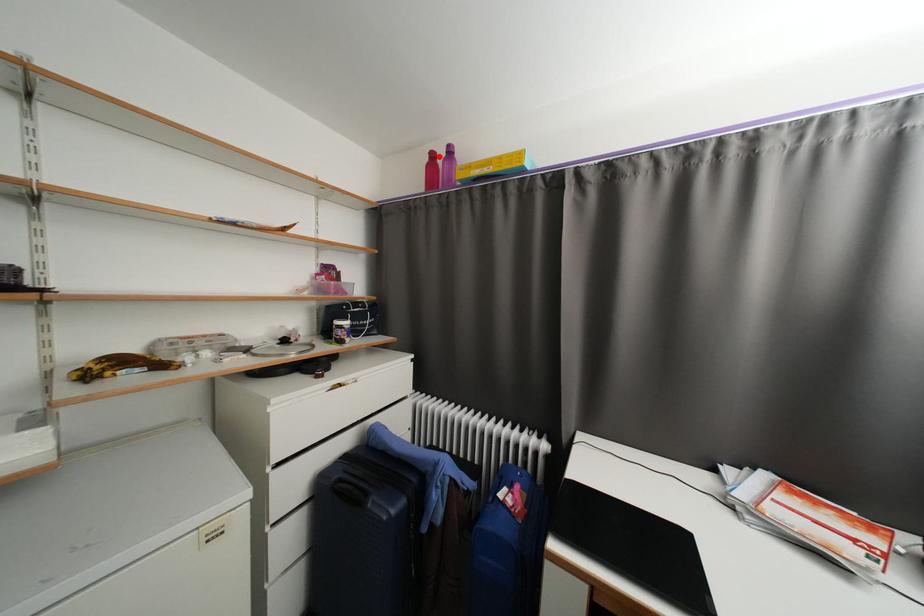
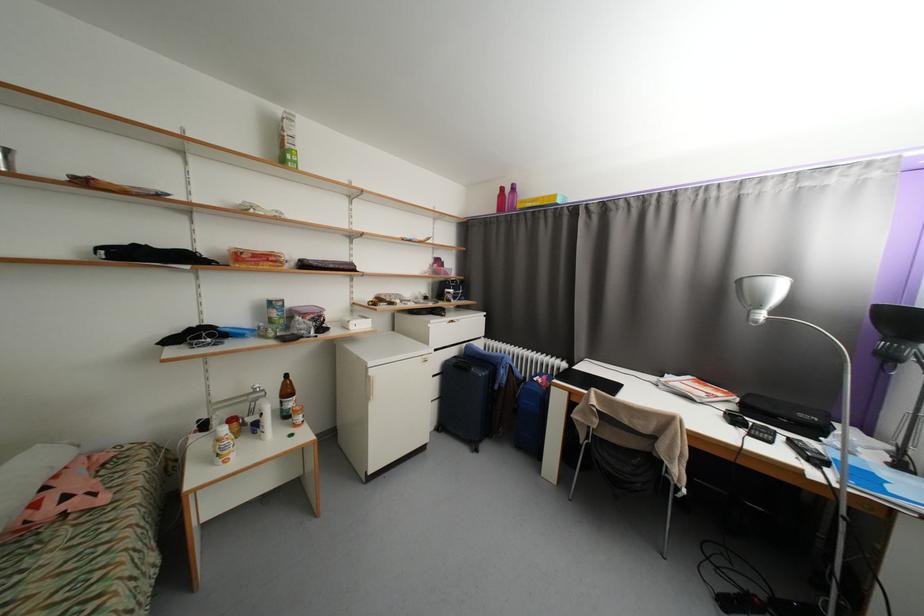
Where in the second image is the point corresponding to the highlighted location from the first image?

(508, 190)